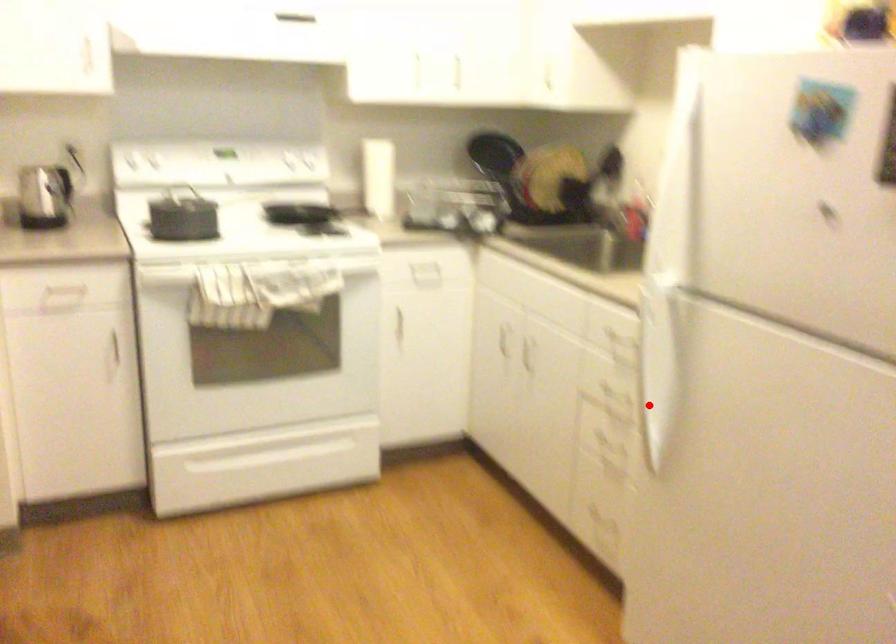
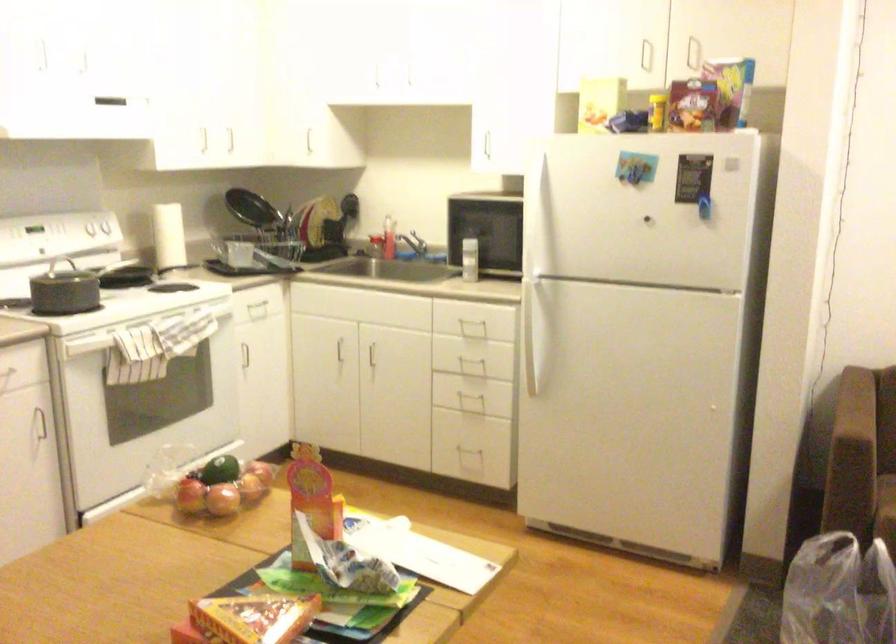
In the second image, find the point that corresponds to the highlighted location in the first image.

(536, 350)